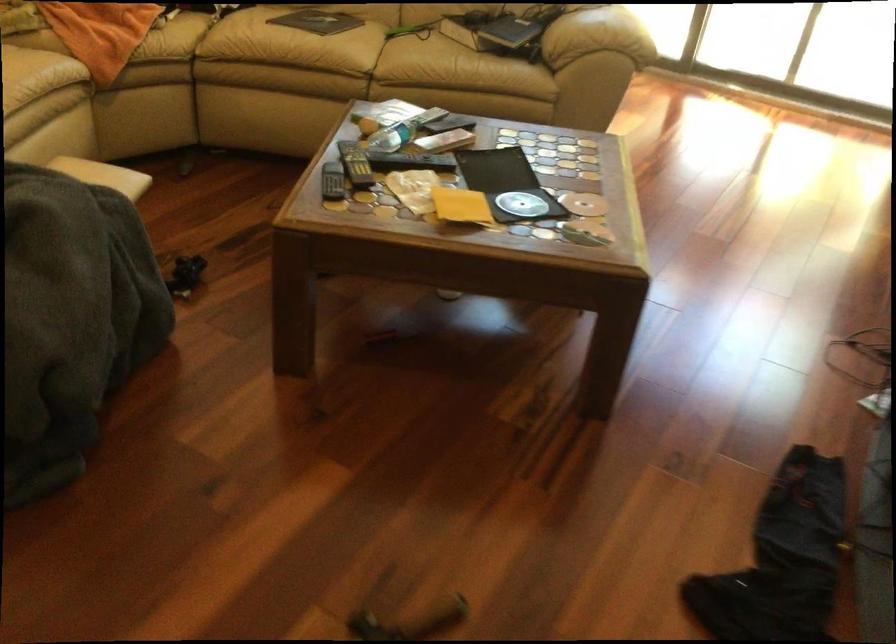
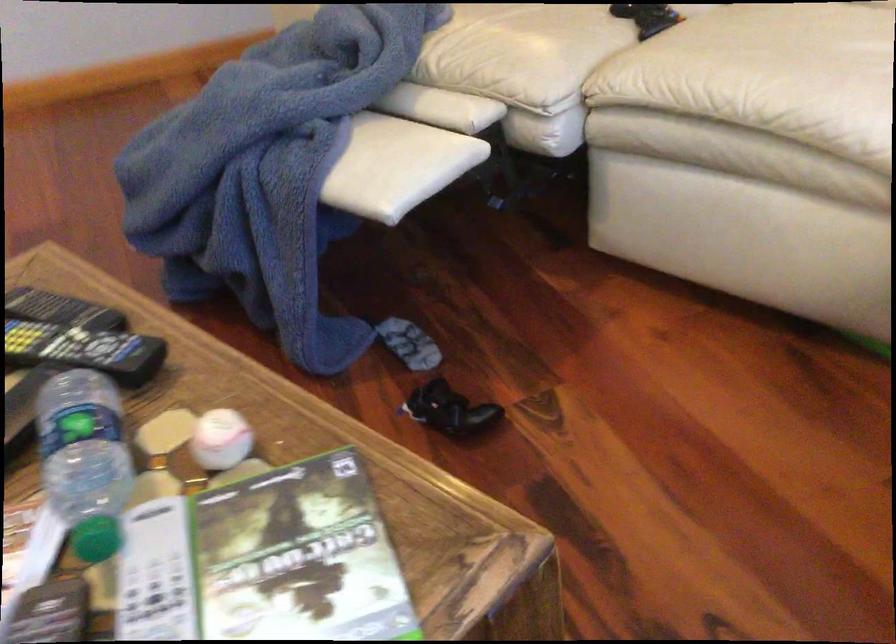
Where in the second image is the point corresponding to the point at 426,122 from the first image?

(96, 538)